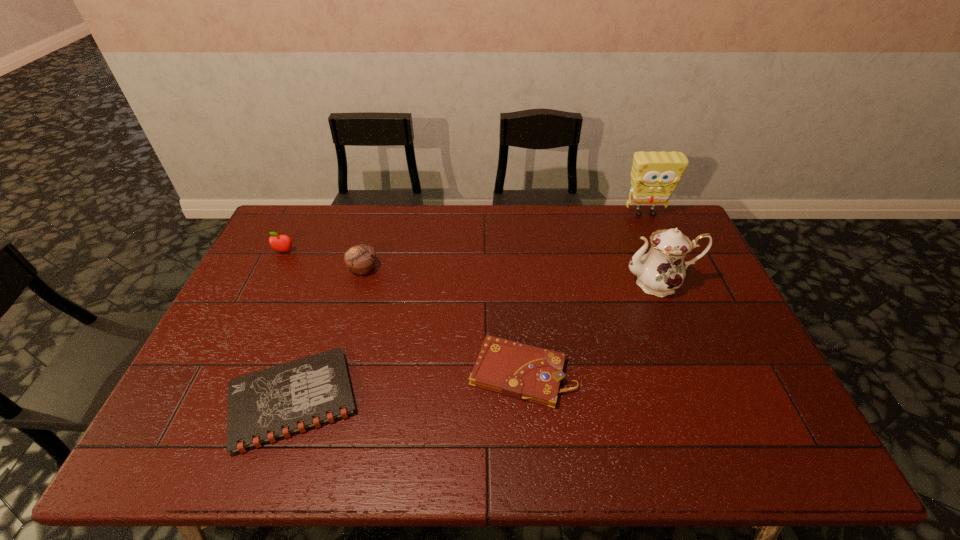
Locate an element on the screen. The width and height of the screenshot is (960, 540). free space located 0.280m on the left of the muffin is located at coordinates (261, 269).

Where is `vacant space located 0.400m on the right of the second farthest object`? vacant space located 0.400m on the right of the second farthest object is located at coordinates (414, 252).

Where is `free space located 0.300m on the right of the second shortest object`? The image size is (960, 540). free space located 0.300m on the right of the second shortest object is located at coordinates (690, 373).

The width and height of the screenshot is (960, 540). In order to click on vacant position located on the left of the left notebook in this screenshot , I will do `click(194, 401)`.

The image size is (960, 540). In order to click on object located at the far edge in this screenshot , I will do `click(655, 175)`.

Identify the location of object positioned at the near edge. This screenshot has width=960, height=540. (265, 406).

This screenshot has width=960, height=540. Identify the location of apple situated at the left edge. (282, 243).

Where is `notebook that is at the left edge`? notebook that is at the left edge is located at coordinates (265, 406).

I want to click on sponge at the right edge, so click(655, 175).

Locate an element on the screen. chinaware located at the right edge is located at coordinates (659, 272).